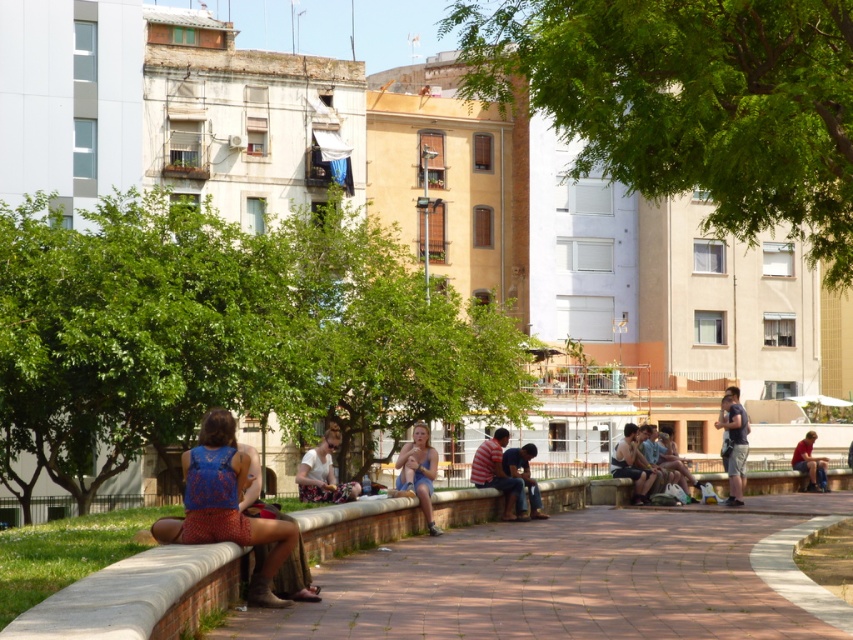
Does white stone ledge at lower left appear under dark blue t-shirt at right?

Yes.

Is point (109, 589) more distant than point (734, 499)?

No, (109, 589) is closer to viewer.

At what (x,y) coordinates should I click in order to perform the action: click on white stone ledge at lower left. Please return your answer as a coordinate pair (x, y). Looking at the image, I should click on (138, 596).

Which is more to the right, green leafy tree at upper center or brick paved path at lower center?

From the viewer's perspective, green leafy tree at upper center appears more on the right side.

Identify the location of green leafy tree at upper center. (689, 100).

Between point (822, 166) and point (566, 572), which one is positioned in front?

Point (566, 572) is more forward.

The width and height of the screenshot is (853, 640). What are the coordinates of `green leafy tree at upper center` in the screenshot? It's located at (689, 100).

Which of these two, dark blue jeans at center or denim shorts at lower right, stands shorter?

With less height is dark blue jeans at center.

Is dark blue jeans at center taller than denim shorts at lower right?

In fact, dark blue jeans at center may be shorter than denim shorts at lower right.

Is point (527, 480) farther from camera compared to point (809, 481)?

No, (527, 480) is in front of (809, 481).

The height and width of the screenshot is (640, 853). In order to click on dark blue jeans at center in this screenshot , I will do `click(523, 480)`.